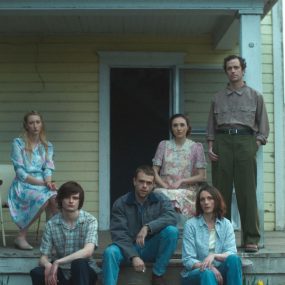
The image size is (285, 285). What are the coordinates of `door` in the screenshot? It's located at (177, 72).